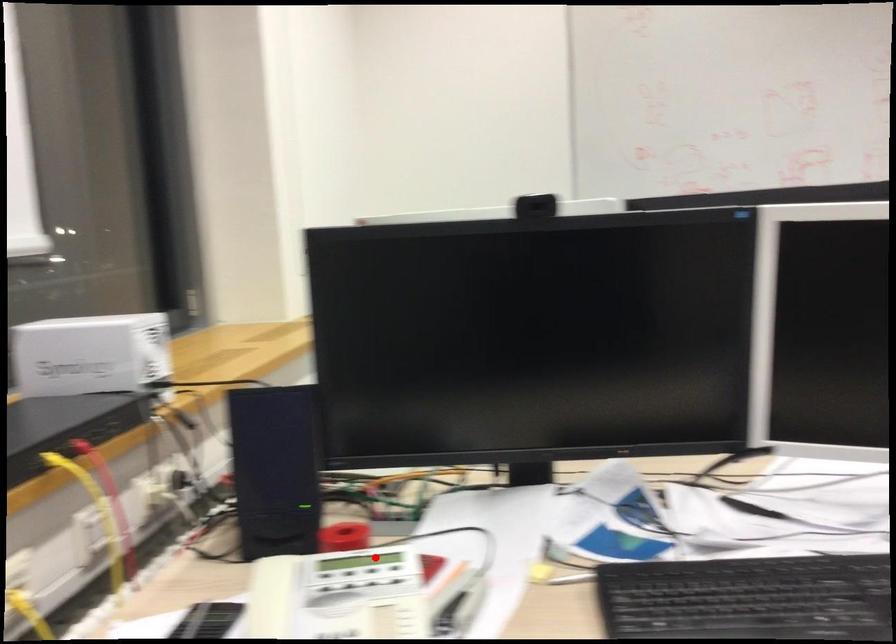
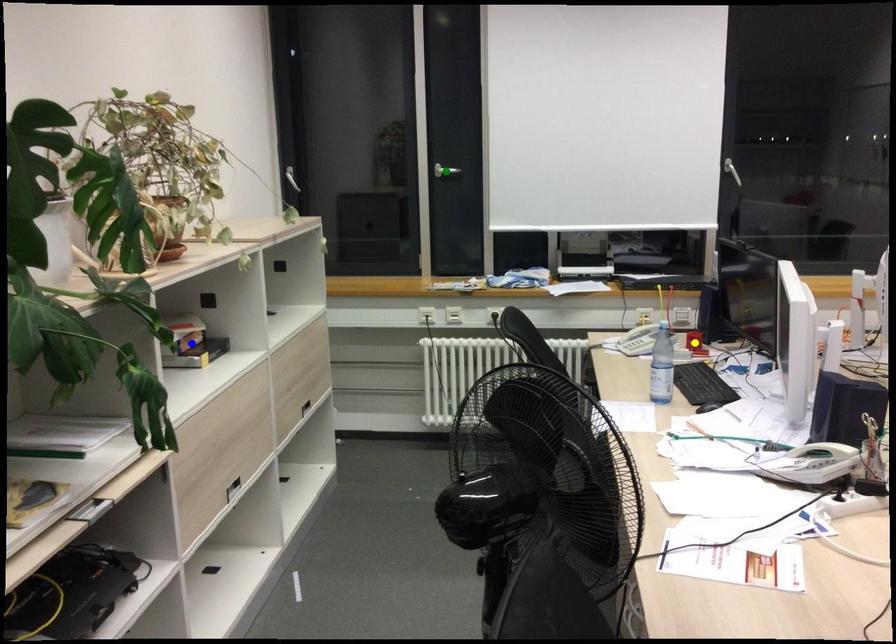
Question: I am providing you with two images of the same scene from different viewpoints. A red point is marked on the first image. You are given multiple points on the second image. Can you choose the point in image 2 that corresponds to the point in image 1?

Choices:
 (A) green point
 (B) yellow point
 (C) blue point

Answer: (B)